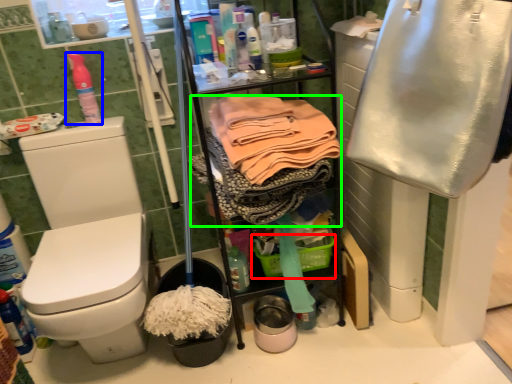
Question: Based on their relative distances, which object is nearer to basket (highlighted by a red box)? Choose from cleaning product (highlighted by a blue box) and clothing (highlighted by a green box).

Choices:
 (A) cleaning product
 (B) clothing

Answer: (B)